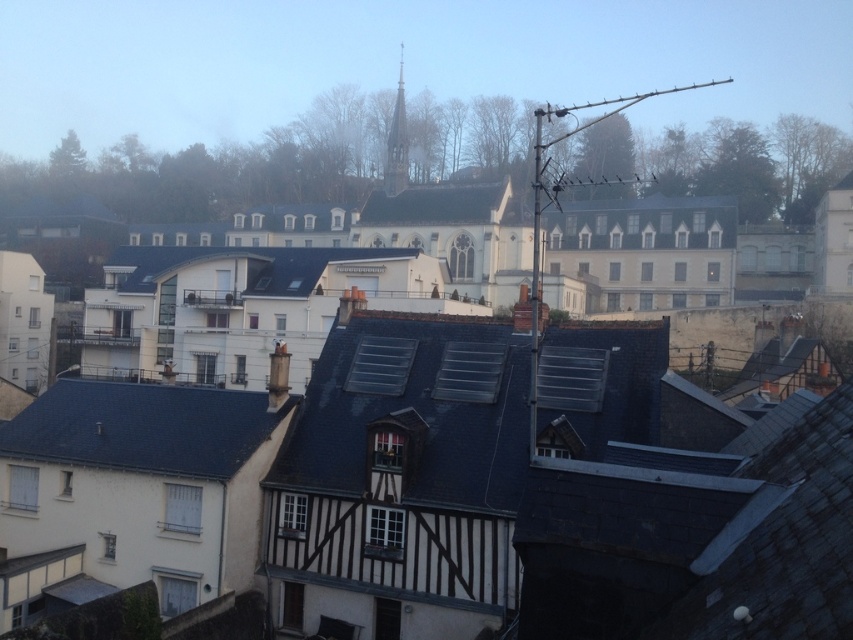
Question: Based on their relative distances, which object is farther from the white shingled roof at center?

Choices:
 (A) gray slate roof at center
 (B) dark gray slate roof at lower left

Answer: (B)

Question: Is gray slate roof at center bigger than white shingled roof at center?

Choices:
 (A) no
 (B) yes

Answer: (B)

Question: Is gray slate roof at center positioned before white shingled roof at center?

Choices:
 (A) no
 (B) yes

Answer: (B)

Question: Which of the following is the closest to the observer?

Choices:
 (A) dark gray slate roof at lower left
 (B) white shingled roof at center
 (C) gray slate roof at center

Answer: (A)

Question: Is dark gray slate roof at lower left to the left of white shingled roof at center from the viewer's perspective?

Choices:
 (A) yes
 (B) no

Answer: (A)

Question: Which point is closer to the camera taking this photo?

Choices:
 (A) (368, 214)
 (B) (80, 413)
 (C) (262, 260)

Answer: (B)